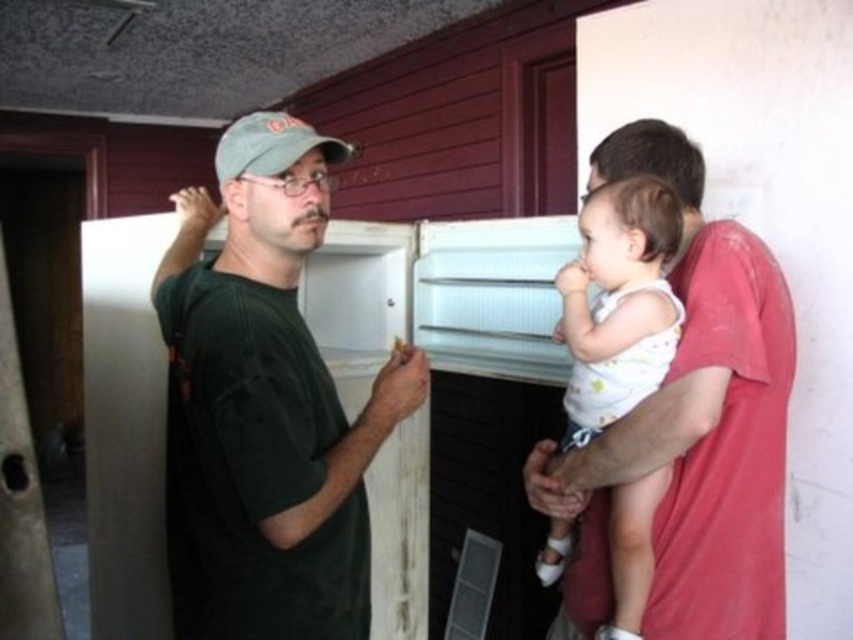
Who is positioned more to the left, matte red shirt at right or green fabric baseball cap at upper center?

green fabric baseball cap at upper center is more to the left.

Does point (560, 458) come in front of point (258, 148)?

No, it is not.

The width and height of the screenshot is (853, 640). I want to click on matte red shirt at right, so click(689, 429).

Is the position of dark green t-shirt at left more distant than that of matte red shirt at right?

No, dark green t-shirt at left is closer to the viewer.

Can you confirm if dark green t-shirt at left is positioned to the left of matte red shirt at right?

Correct, you'll find dark green t-shirt at left to the left of matte red shirt at right.

Is point (309, 188) closer to viewer compared to point (772, 336)?

Yes, point (309, 188) is closer to viewer.

This screenshot has height=640, width=853. I want to click on dark green t-shirt at left, so click(265, 404).

This screenshot has width=853, height=640. I want to click on matte red shirt at right, so click(689, 429).

Between matte red shirt at right and white cotton baby at center, which one has less height?

With less height is white cotton baby at center.

Who is more forward, [711,500] or [668,188]?

Point [711,500] is more forward.

Identify the location of matte red shirt at right. Image resolution: width=853 pixels, height=640 pixels. (689, 429).